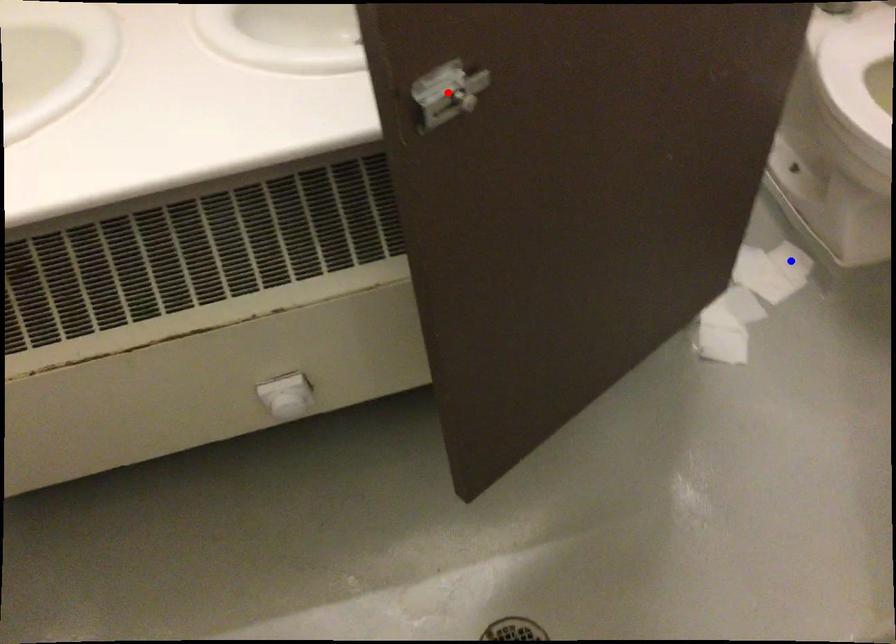
Question: Which of the two points in the image is closer to the camera?

Choices:
 (A) Blue point is closer.
 (B) Red point is closer.

Answer: (B)